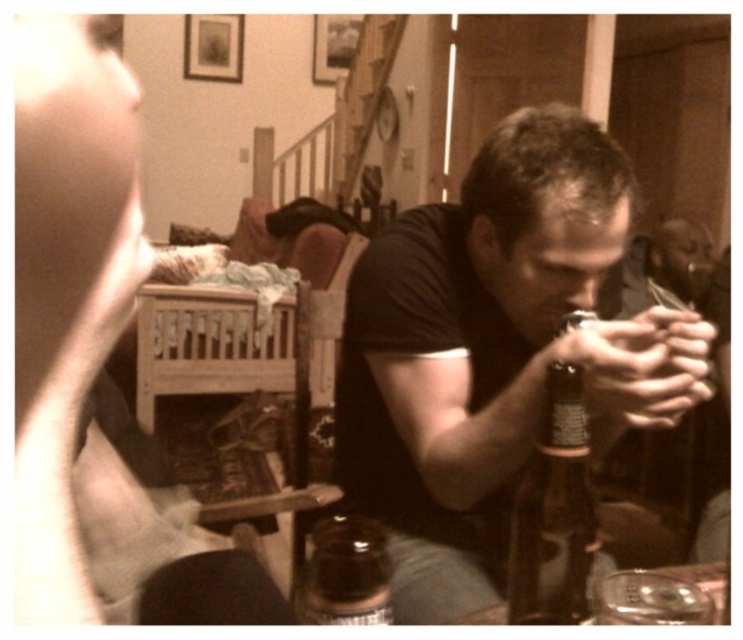
Question: Does matte black shirt at center appear over matte black camera at center?

Choices:
 (A) no
 (B) yes

Answer: (B)

Question: Which object is farther from the camera taking this photo?

Choices:
 (A) brown glass bottle at center
 (B) matte black camera at center
 (C) translucent glass bottle at lower center

Answer: (A)

Question: Which object is positioned farthest from the matte black shirt at center?

Choices:
 (A) brown glass bottle at center
 (B) translucent glass bottle at lower center
 (C) matte black camera at center

Answer: (C)

Question: Is brown glass bottle at center further to the viewer compared to translucent glass bottle at lower center?

Choices:
 (A) no
 (B) yes

Answer: (B)

Question: Which is farther from the matte black shirt at center?

Choices:
 (A) translucent glass bottle at lower center
 (B) matte black camera at center
 (C) brown glass bottle at center

Answer: (B)

Question: Is matte black camera at center above brown glass bottle at center?

Choices:
 (A) yes
 (B) no

Answer: (A)